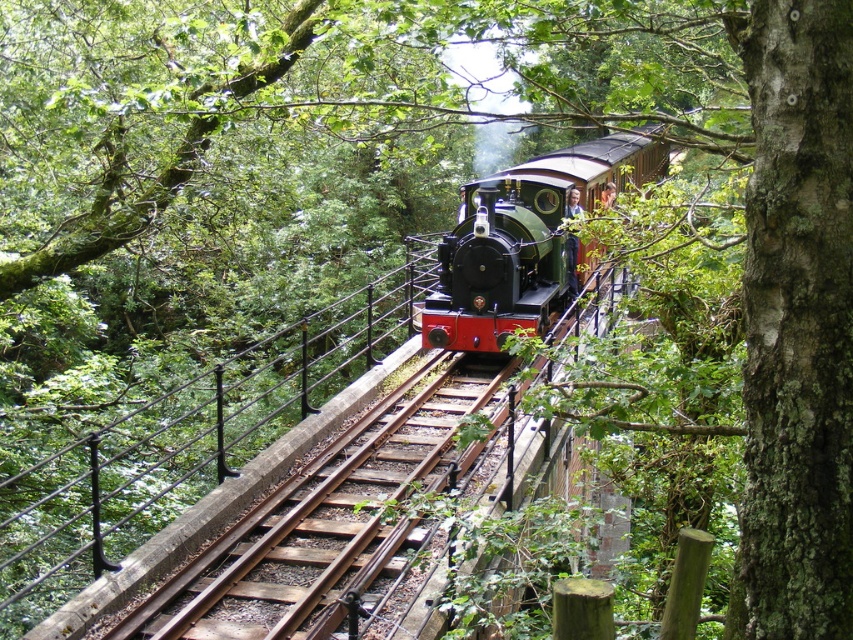
Who is more distant from viewer, (62, 592) or (494, 192)?

Point (494, 192)

What are the coordinates of `black metal rail at center` in the screenshot? It's located at (189, 440).